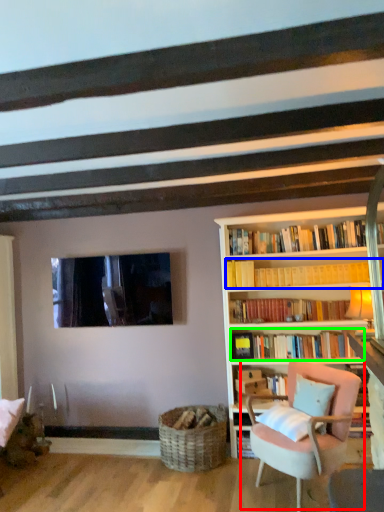
Question: Based on their relative distances, which object is farther from chair (highlighted by a red box)? Choose from book (highlighted by a blue box) and book (highlighted by a green box).

Choices:
 (A) book
 (B) book

Answer: (A)